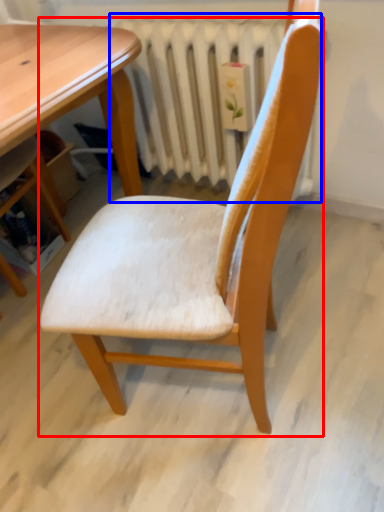
Question: Which object appears farthest to the camera in this image, chair (highlighted by a red box) or radiator (highlighted by a blue box)?

Choices:
 (A) chair
 (B) radiator

Answer: (B)